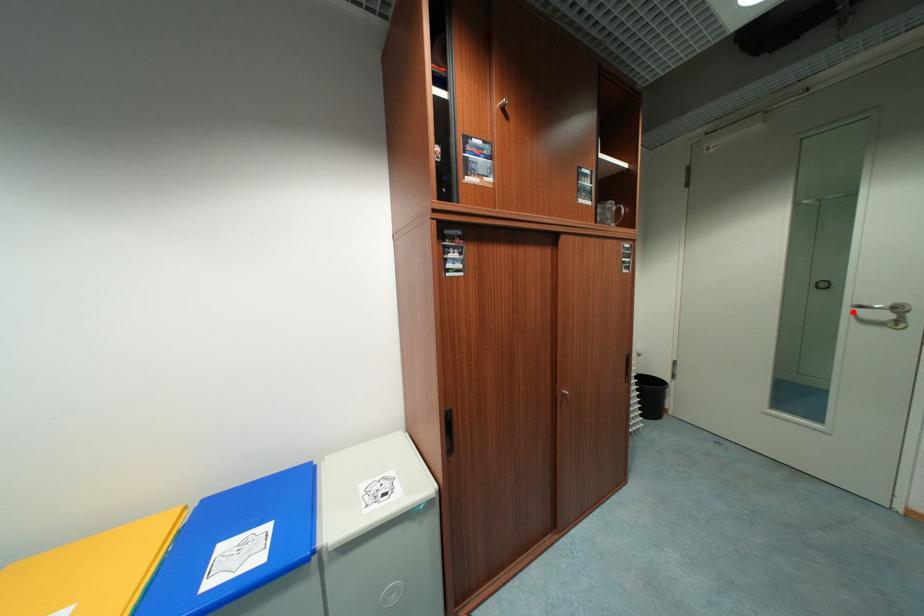
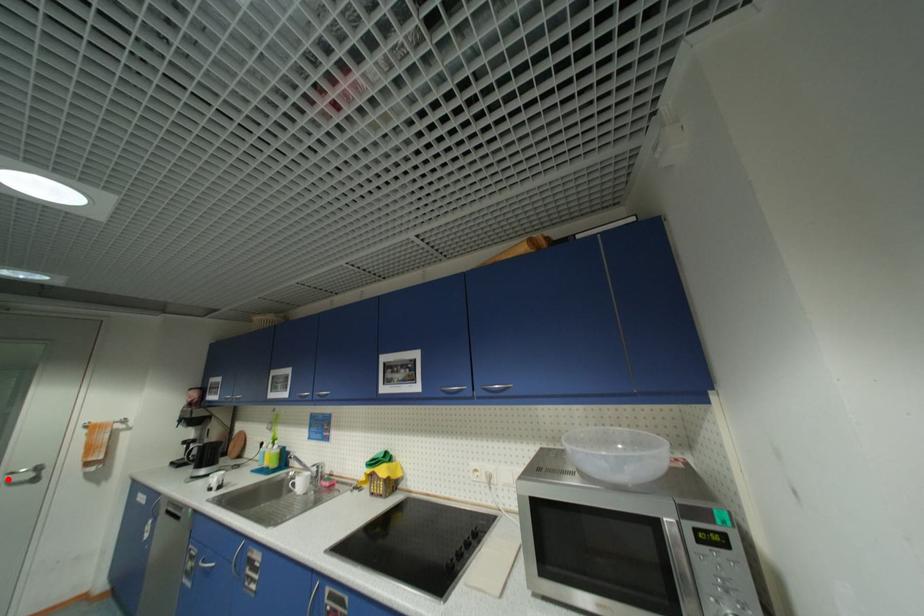
I am providing you with two images of the same scene from different viewpoints. A red point is marked on the first image and another point is marked on the second image. Is the marked point in image1 the same physical position as the marked point in image2?

Yes